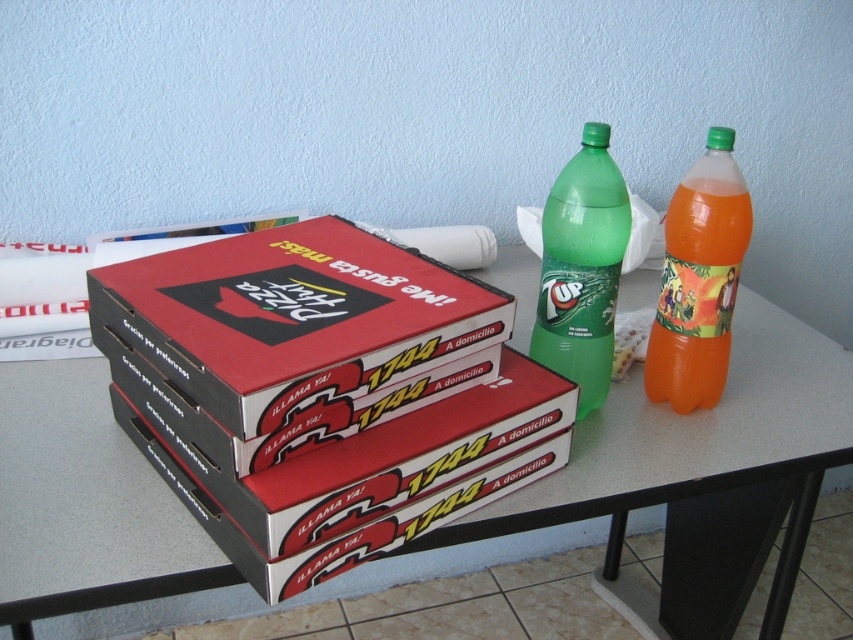
Please describe the location of the point labeled as point (x=697, y=454) in the image. Is it on the table or on the wall?

The point labeled as point (x=697, y=454) is on the white glossy table at center.

In the scene shown: What is located at the coordinates point (x=697, y=454) in the image?

At point (x=697, y=454) lies the white glossy table at center.

You are standing in front of the table with the pizza boxes and soda bottles. If you want to place a new pizza box exactly where the matte cardboard pizza box at center is currently located, what coordinates should you aim for?

You should aim for coordinates point [294,317] where the matte cardboard pizza box at center is located.